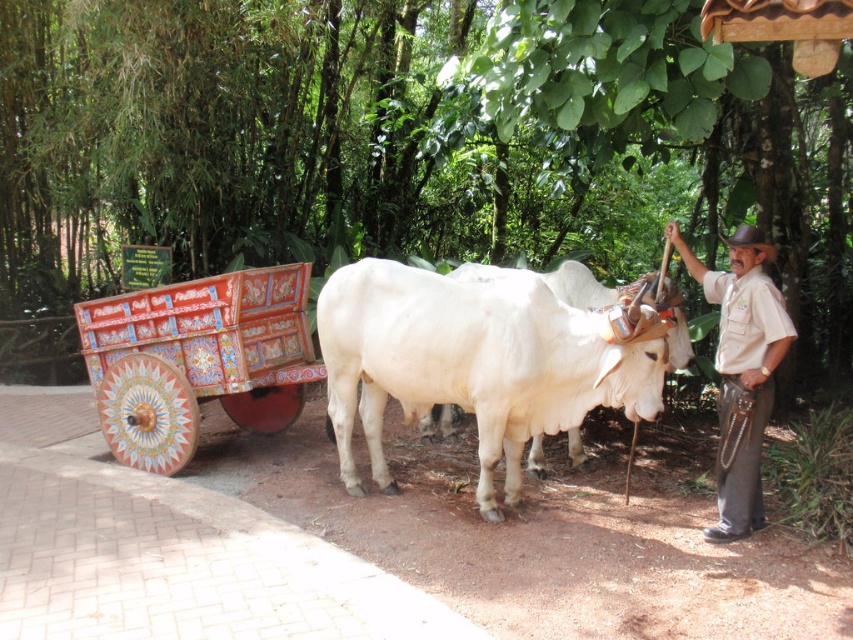
Question: Is the position of painted wood wagon at left more distant than that of beige uniform at center?

Choices:
 (A) yes
 (B) no

Answer: (A)

Question: Estimate the real-world distances between objects in this image. Which object is closer to the painted wood wagon at left?

Choices:
 (A) white smooth bull at center
 (B) green leafy tree at upper center
 (C) beige uniform at center

Answer: (A)

Question: Does painted wood wagon at left appear over beige uniform at center?

Choices:
 (A) no
 (B) yes

Answer: (B)

Question: Which object appears farthest from the camera in this image?

Choices:
 (A) white smooth bull at center
 (B) beige uniform at center

Answer: (A)

Question: Can you confirm if painted wood wagon at left is positioned to the left of beige uniform at center?

Choices:
 (A) yes
 (B) no

Answer: (A)

Question: Which object is positioned closest to the white smooth bull at center?

Choices:
 (A) green leafy tree at upper center
 (B) beige uniform at center

Answer: (B)